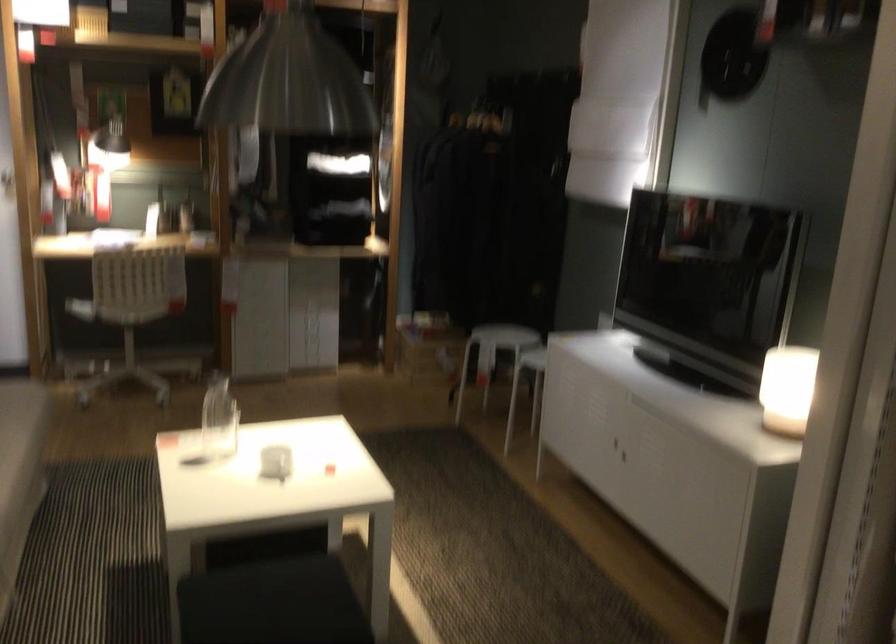
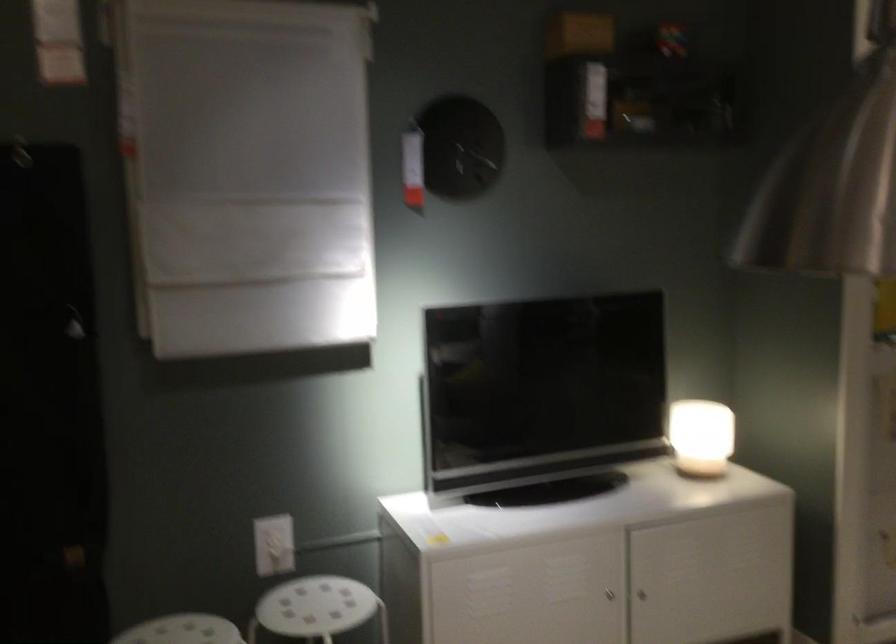
Where in the second image is the point corresponding to (x=607, y=323) from the first image?

(273, 545)